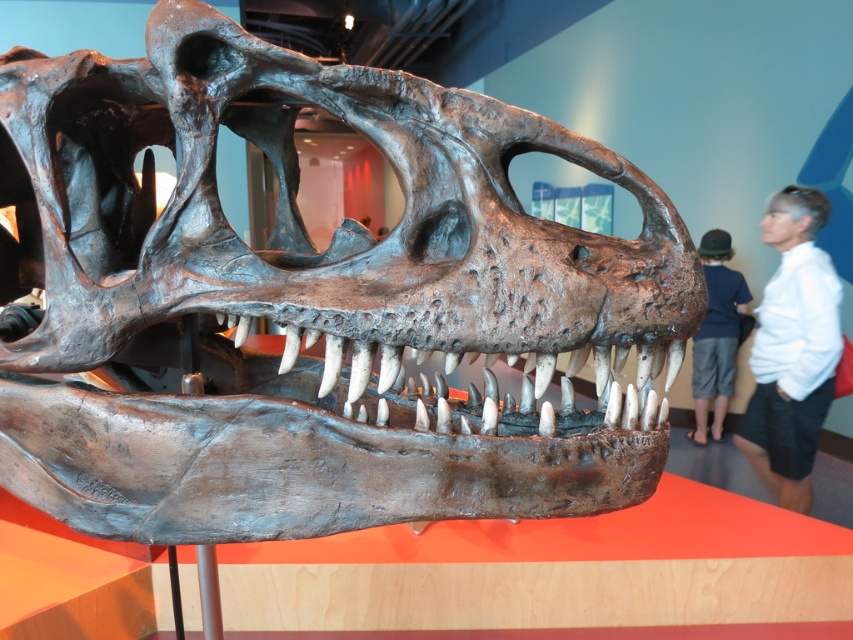
You are a museum visitor standing in front of the dinosaur skull display. You notice two points marked on the floor, one at point (97,168) and the other at point (705,316). If you want to take a photo that includes both points in the background, which point should you stand closer to?

You should stand closer to point (705,316) because point (97,168) is behind it, so positioning yourself near the closer point will ensure both are visible in the photo.

You are a photographer setting up for a photoshoot in a museum. You notice two shirts hanging on a rack near the dinosaur skull display. The shirts are the white matte shirt at upper right and the dark blue shirt at right. Which shirt takes up more space on the rack?

The white matte shirt at upper right is larger in size than the dark blue shirt at right, so it takes up more space on the rack.

You are a museum visitor standing in front of the dinosaur skull exhibit. You notice a specific point marked at coordinates [311,304]. What object is located at this point?

The rusty metallic skull at center is located at point [311,304].